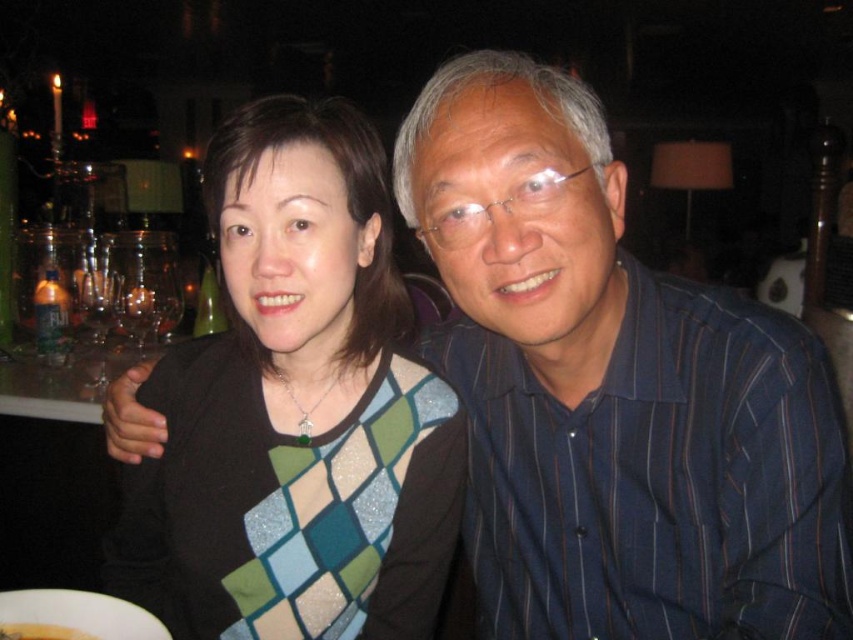
Question: Which point appears closest to the camera in this image?

Choices:
 (A) (85, 381)
 (B) (82, 634)

Answer: (B)

Question: Which point is closer to the camera taking this photo?

Choices:
 (A) (280, 182)
 (B) (84, 385)
 (C) (128, 609)
 (D) (24, 627)

Answer: (D)

Question: Can you confirm if matte black sweater at center is smaller than matte glass table at lower left?

Choices:
 (A) yes
 (B) no

Answer: (B)

Question: Is white glossy plate at lower left thinner than yellow smooth banana at lower left?

Choices:
 (A) yes
 (B) no

Answer: (B)

Question: Which of the following is the closest to the observer?

Choices:
 (A) (543, 266)
 (B) (47, 636)
 (C) (357, 486)
 (D) (78, 365)

Answer: (A)

Question: Is matte black sweater at center closer to the viewer compared to yellow smooth banana at lower left?

Choices:
 (A) no
 (B) yes

Answer: (A)